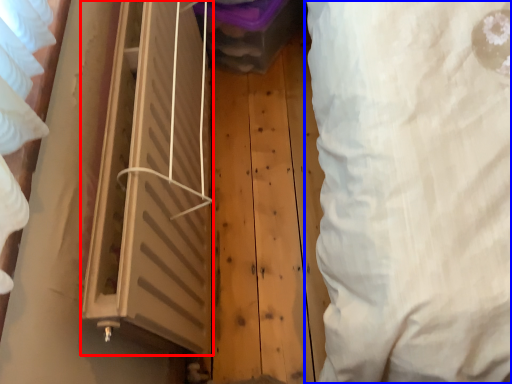
Question: Which point is closer to the camera, window (highlighted by a red box) or curtain (highlighted by a blue box)?

Choices:
 (A) window
 (B) curtain

Answer: (B)